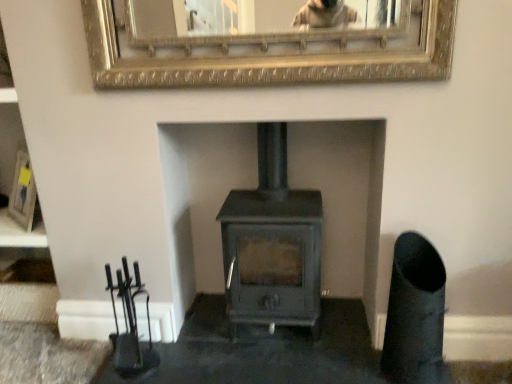
Question: Does matte black picture frame at left, which ranks as the 1th picture frame in back-to-front order, have a greater height compared to matte gray wood burning stove at center?

Choices:
 (A) no
 (B) yes

Answer: (A)

Question: Is matte black picture frame at left, acting as the first picture frame starting from the bottom, to the left of matte gray wood burning stove at center from the viewer's perspective?

Choices:
 (A) no
 (B) yes

Answer: (B)

Question: Is matte black picture frame at left, placed as the 2th picture frame when sorted from top to bottom, positioned beyond the bounds of matte gray wood burning stove at center?

Choices:
 (A) yes
 (B) no

Answer: (A)

Question: Can you confirm if matte black picture frame at left, which ranks as the 1th picture frame in back-to-front order, is thinner than matte gray wood burning stove at center?

Choices:
 (A) no
 (B) yes

Answer: (B)

Question: Is the depth of matte black picture frame at left, the 2th picture frame positioned from the front, greater than that of matte gray wood burning stove at center?

Choices:
 (A) no
 (B) yes

Answer: (B)

Question: Are matte black picture frame at left, placed as the 2th picture frame when sorted from top to bottom, and matte gray wood burning stove at center far apart?

Choices:
 (A) yes
 (B) no

Answer: (A)

Question: Is gold textured mirror at upper center, the second picture frame ordered from the bottom, directly adjacent to matte gray wood burning stove at center?

Choices:
 (A) yes
 (B) no

Answer: (B)

Question: From a real-world perspective, is gold textured mirror at upper center, the second picture frame ordered from the bottom, located beneath matte gray wood burning stove at center?

Choices:
 (A) no
 (B) yes

Answer: (A)

Question: Considering the relative sizes of gold textured mirror at upper center, which is the first picture frame from front to back, and matte gray wood burning stove at center in the image provided, is gold textured mirror at upper center, which is the first picture frame from front to back, smaller than matte gray wood burning stove at center?

Choices:
 (A) yes
 (B) no

Answer: (A)

Question: From the image's perspective, is gold textured mirror at upper center, the second picture frame ordered from the bottom, above matte gray wood burning stove at center?

Choices:
 (A) yes
 (B) no

Answer: (A)

Question: Is gold textured mirror at upper center, which is the first picture frame from front to back, at the right side of matte gray wood burning stove at center?

Choices:
 (A) no
 (B) yes

Answer: (A)

Question: Is gold textured mirror at upper center, the second picture frame ordered from the bottom, taller than matte gray wood burning stove at center?

Choices:
 (A) no
 (B) yes

Answer: (A)

Question: From the image's perspective, is matte black picture frame at left, the 2th picture frame positioned from the right, above gold textured mirror at upper center, the second picture frame ordered from the bottom?

Choices:
 (A) no
 (B) yes

Answer: (A)